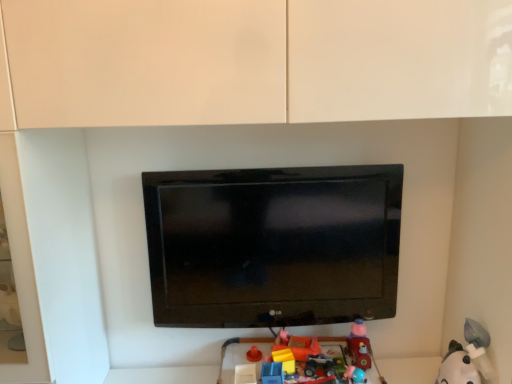
I want to click on vacant region to the left of matte plastic toy car at lower right, positioned as the 2th toy in right-to-left order, so click(x=330, y=364).